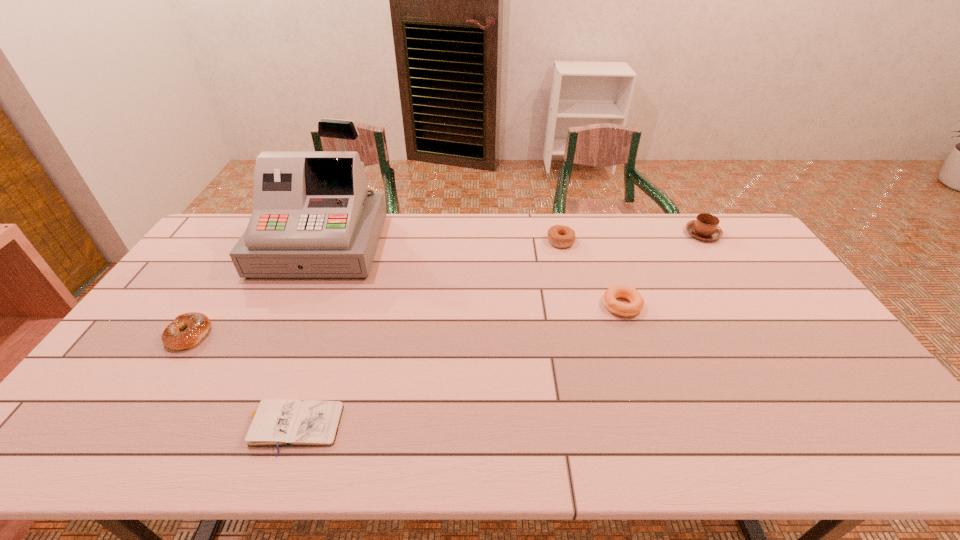
Locate an element on the screen. The height and width of the screenshot is (540, 960). vacant region located 0.070m on the side of the fifth shortest object with the handle is located at coordinates (689, 214).

The height and width of the screenshot is (540, 960). What are the coordinates of `vacant space situated 0.260m on the right of the second bagel from left to right` in the screenshot? It's located at (647, 241).

I want to click on free space located on the back of the second object from right to left, so click(604, 254).

The width and height of the screenshot is (960, 540). Identify the location of free space located 0.100m on the back of the leftmost bagel. (216, 294).

Find the location of a particular element. This screenshot has height=540, width=960. free location located 0.140m on the back of the nearest object is located at coordinates (316, 354).

The image size is (960, 540). In order to click on cash register located in the far edge section of the desktop in this screenshot , I will do `click(313, 217)`.

Locate an element on the screen. cappuccino that is at the far edge is located at coordinates (705, 227).

The image size is (960, 540). In order to click on bagel present at the far edge in this screenshot , I will do `click(559, 236)`.

The image size is (960, 540). In order to click on object located in the near edge section of the desktop in this screenshot , I will do `click(273, 422)`.

The image size is (960, 540). In order to click on object that is at the left edge in this screenshot , I will do `click(197, 325)`.